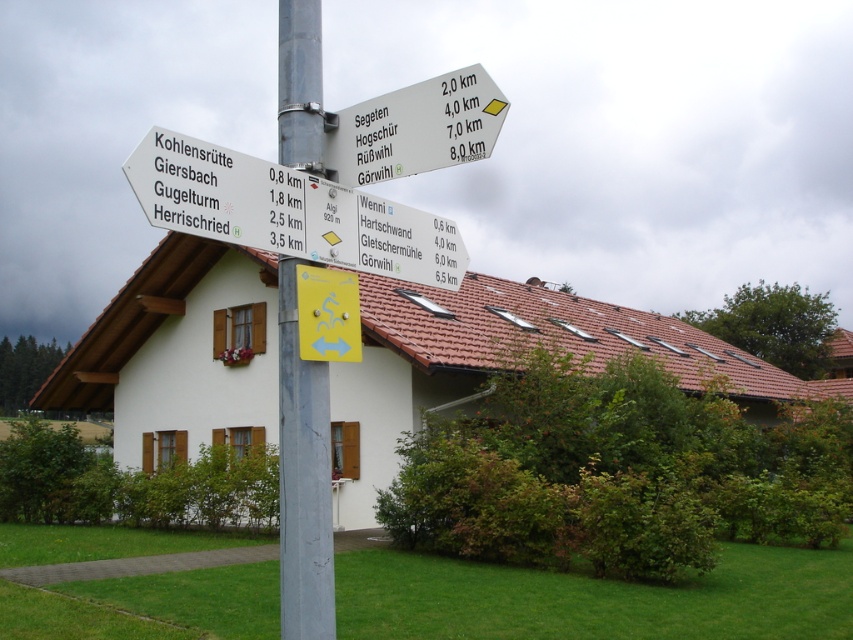
You are a hiker trying to read the directional signs on the signpost. You notice the white plastic sign at upper left and the metallic pole at center. Which object is positioned higher up?

The white plastic sign at upper left is above the metallic pole at center, so it is positioned higher up.

You are standing in front of the signpost and want to know which of the two points, point (300, 97) or point (502, 113), is closer to you. Based on the signpost details, which point is nearer?

Point (300, 97) is further to the camera than point (502, 113), so the point closer to you is point (502, 113).

You are a delivery drone with a wingspan of 1 meter. You need to fly between the white plastic sign at upper left and the white plastic signpost at upper center to deliver a package. Can you safely pass through the gap between them?

The gap between the white plastic sign at upper left and the white plastic signpost at upper center is 1.14 meters. Since your wingspan is 1 meter, which is narrower than the gap, you can safely pass through the space between them.